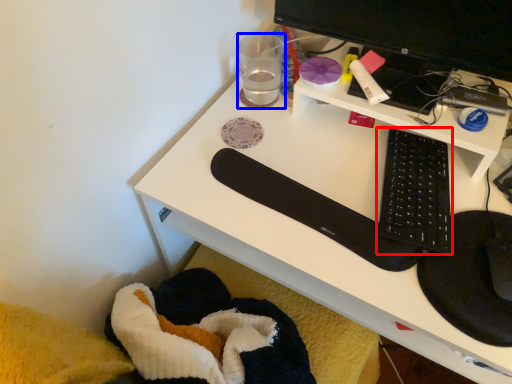
Question: Which of the following is the farthest to the observer, computer keyboard (highlighted by a red box) or stationery (highlighted by a blue box)?

Choices:
 (A) computer keyboard
 (B) stationery

Answer: (B)